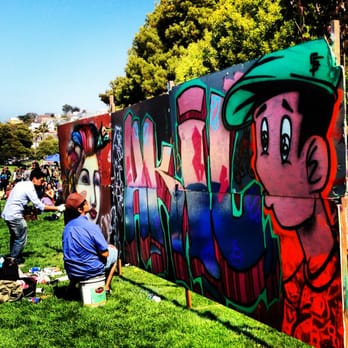
The image size is (348, 348). In order to click on bucket in this screenshot , I will do `click(95, 294)`.